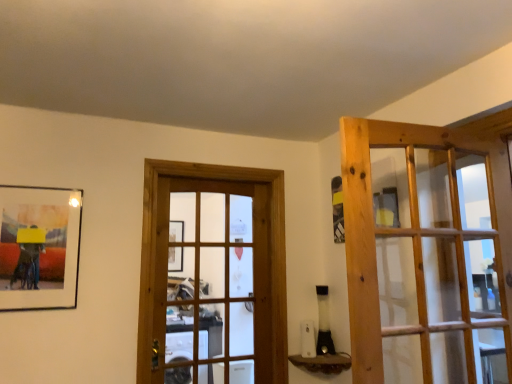
Question: From their relative heights in the image, would you say wooden door at center, which is the 1th door in left-to-right order, is taller or shorter than brown textured wood at lower center?

Choices:
 (A) short
 (B) tall

Answer: (B)

Question: Considering the relative positions of wooden door at center, which is counted as the 2th door, starting from the right, and brown textured wood at lower center in the image provided, is wooden door at center, which is counted as the 2th door, starting from the right, to the left or to the right of brown textured wood at lower center?

Choices:
 (A) left
 (B) right

Answer: (A)

Question: Which object is positioned farthest from the matte black picture frame at left?

Choices:
 (A) brown textured wood at lower center
 (B) natural wood door at right, the 1th door in the right-to-left sequence
 (C) wooden door at center, which is the 2th door in front-to-back order

Answer: (B)

Question: Estimate the real-world distances between objects in this image. Which object is closer to the wooden door at center, which is counted as the 2th door, starting from the right?

Choices:
 (A) natural wood door at right, positioned as the first door in front-to-back order
 (B) brown textured wood at lower center
 (C) matte black picture frame at left

Answer: (C)